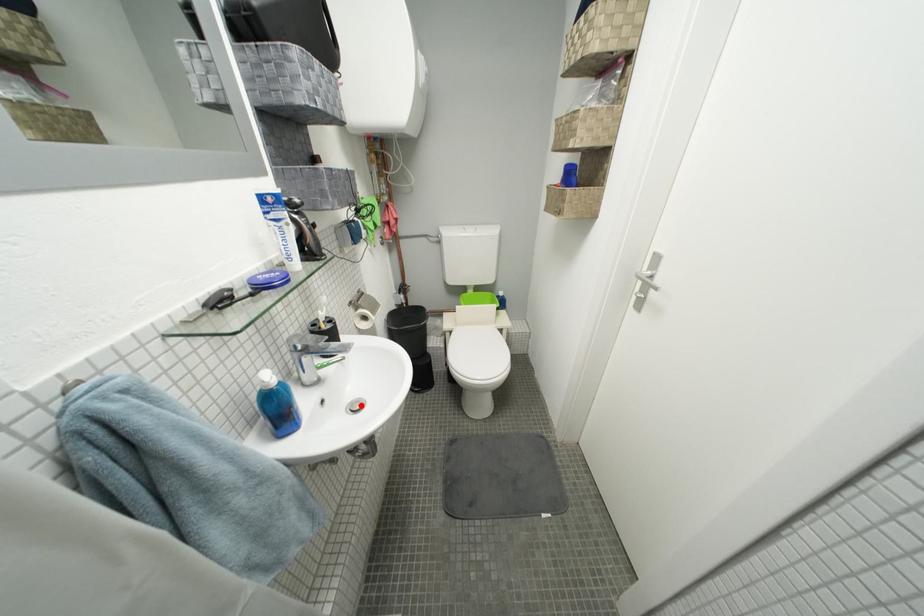
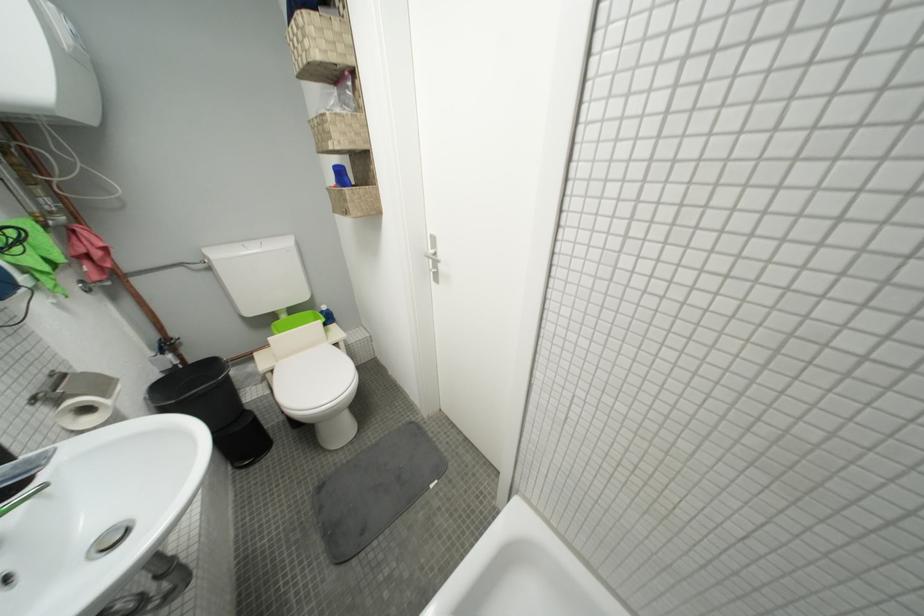
The point at the highlighted location is marked in the first image. Where is the corresponding point in the second image?

(107, 541)